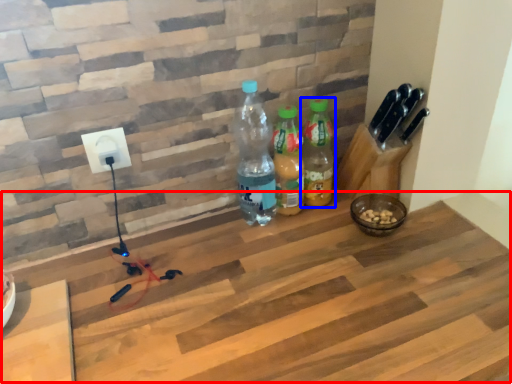
Question: Among these objects, which one is farthest to the camera, workbench (highlighted by a red box) or bottle (highlighted by a blue box)?

Choices:
 (A) workbench
 (B) bottle

Answer: (B)